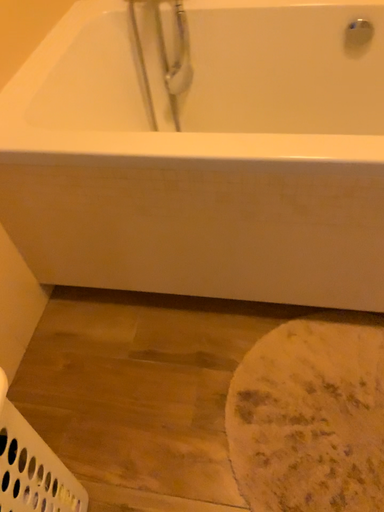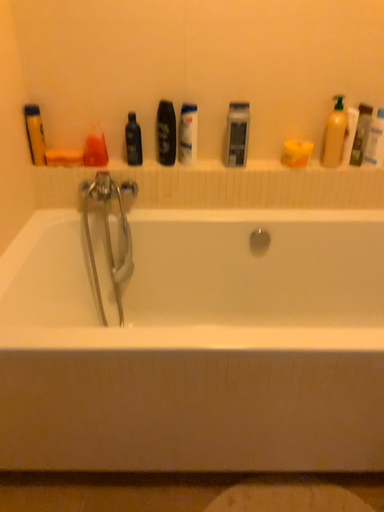
Question: How did the camera likely rotate when shooting the video?

Choices:
 (A) rotated right
 (B) rotated left

Answer: (A)